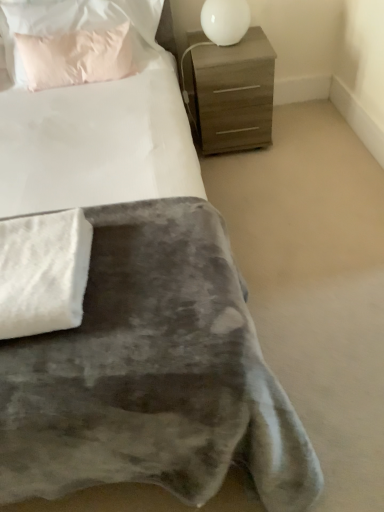
Question: Is white glossy table lamp at upper right outside of white fluffy blanket at lower left?

Choices:
 (A) yes
 (B) no

Answer: (A)

Question: Is the depth of white glossy table lamp at upper right less than that of white fluffy blanket at lower left?

Choices:
 (A) yes
 (B) no

Answer: (B)

Question: Can you confirm if white glossy table lamp at upper right is positioned to the left of white fluffy blanket at lower left?

Choices:
 (A) yes
 (B) no

Answer: (B)

Question: Does white glossy table lamp at upper right lie behind white fluffy blanket at lower left?

Choices:
 (A) no
 (B) yes

Answer: (B)

Question: Does white glossy table lamp at upper right appear on the right side of white fluffy blanket at lower left?

Choices:
 (A) no
 (B) yes

Answer: (B)

Question: Is white glossy table lamp at upper right taller than white fluffy blanket at lower left?

Choices:
 (A) yes
 (B) no

Answer: (A)

Question: Does matte brown chest of drawers at upper right come in front of white fluffy blanket at lower left?

Choices:
 (A) no
 (B) yes

Answer: (A)

Question: Can you confirm if matte brown chest of drawers at upper right is shorter than white fluffy blanket at lower left?

Choices:
 (A) no
 (B) yes

Answer: (A)

Question: Is matte brown chest of drawers at upper right not inside white fluffy blanket at lower left?

Choices:
 (A) no
 (B) yes

Answer: (B)

Question: Is matte brown chest of drawers at upper right facing away from white fluffy blanket at lower left?

Choices:
 (A) no
 (B) yes

Answer: (A)

Question: Considering the relative positions of matte brown chest of drawers at upper right and white fluffy blanket at lower left in the image provided, is matte brown chest of drawers at upper right to the right of white fluffy blanket at lower left from the viewer's perspective?

Choices:
 (A) no
 (B) yes

Answer: (B)

Question: Is matte brown chest of drawers at upper right behind white fluffy blanket at lower left?

Choices:
 (A) no
 (B) yes

Answer: (B)

Question: Is pink fabric pillow at upper left directly adjacent to white fluffy blanket at lower left?

Choices:
 (A) no
 (B) yes

Answer: (A)